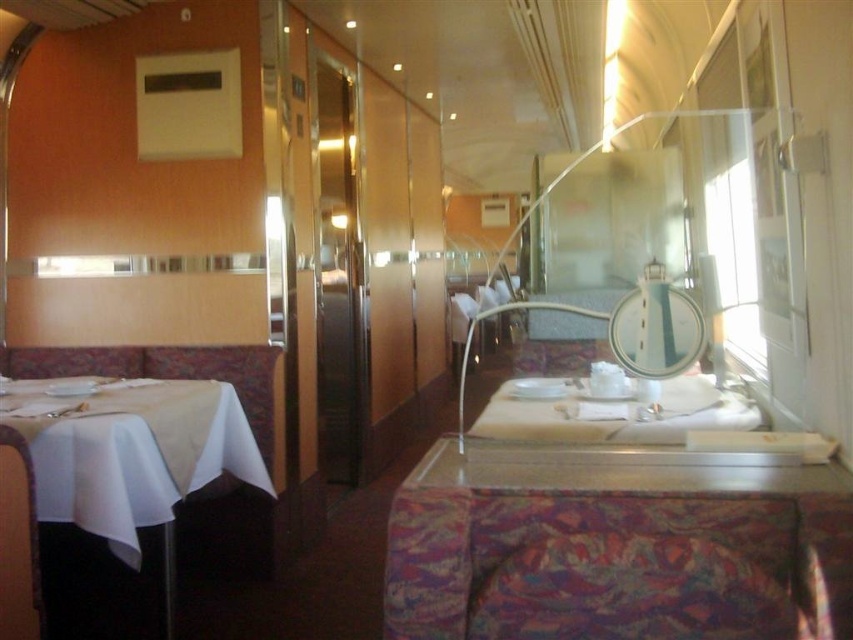
Does white cloth table at left appear under white glossy plate at center?

Yes.

Is white cloth table at left further to camera compared to white glossy plate at center?

That is True.

The width and height of the screenshot is (853, 640). What are the coordinates of `white cloth table at left` in the screenshot? It's located at (129, 451).

At what (x,y) coordinates should I click in order to perform the action: click on white cloth table at left. Please return your answer as a coordinate pair (x, y). Looking at the image, I should click on (129, 451).

Can you confirm if patterned fabric table at center is shorter than white glossy plate at center?

No, patterned fabric table at center is not shorter than white glossy plate at center.

Who is more distant from viewer, (648, 625) or (508, 416)?

The point (508, 416) is behind.

Identify the location of patterned fabric table at center. (618, 552).

Is point (703, 588) farther from viewer compared to point (32, 388)?

No.

Where is `patterned fabric table at center`? The image size is (853, 640). patterned fabric table at center is located at coordinates (618, 552).